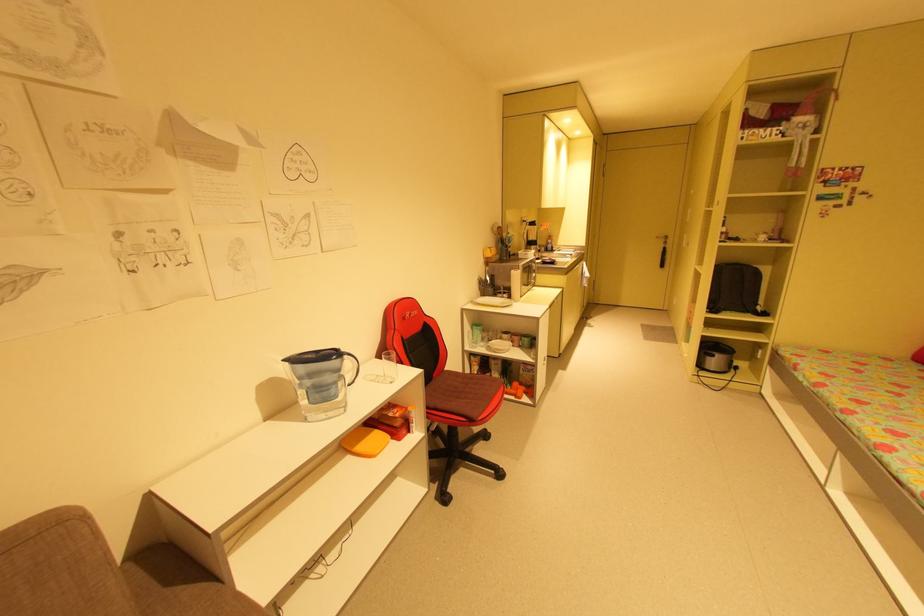
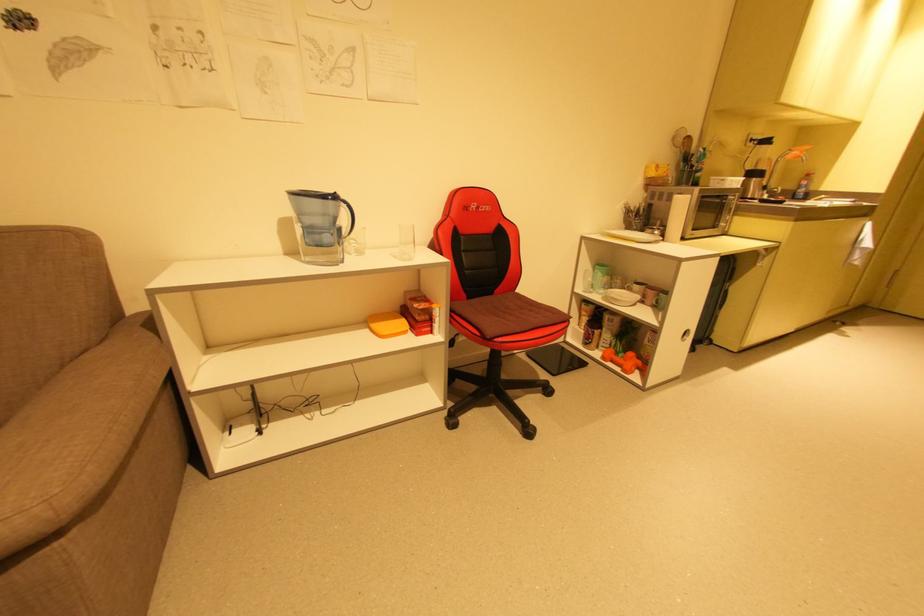
Where in the second image is the point corresponding to [383,383] from the first image?

(400, 257)